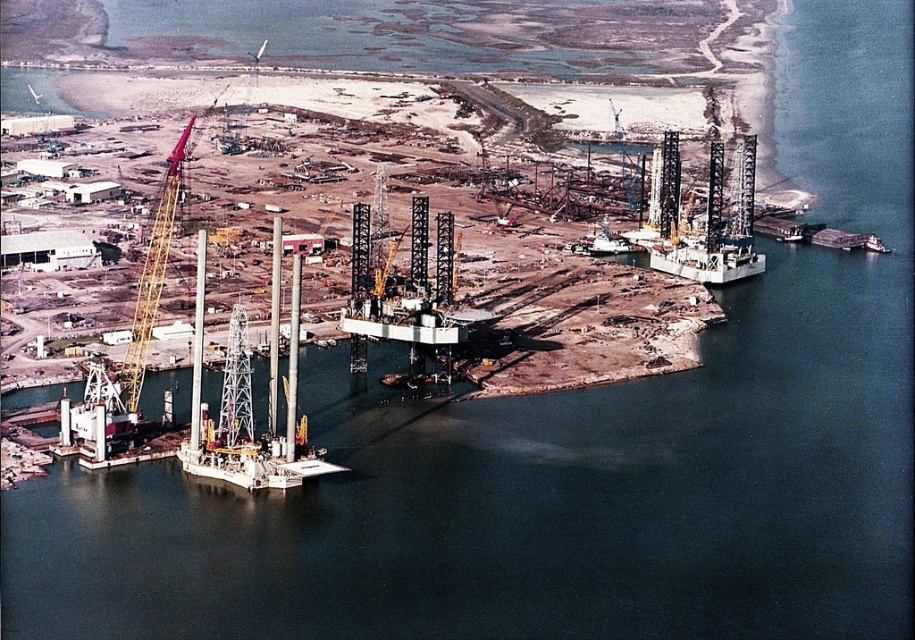
Question: Observing the image, what is the correct spatial positioning of yellow metallic crane at left in reference to metallic gray ship at center?

Choices:
 (A) below
 (B) above

Answer: (A)

Question: Does white matte oil rig at center-right lie behind metallic gray ship at center?

Choices:
 (A) yes
 (B) no

Answer: (A)

Question: Considering the relative positions of white matte oil rig at center-right and metallic gray ship at center in the image provided, where is white matte oil rig at center-right located with respect to metallic gray ship at center?

Choices:
 (A) right
 (B) left

Answer: (A)

Question: Considering the real-world distances, which object is farthest from the yellow metallic crane at left?

Choices:
 (A) metallic gray ship at center
 (B) white matte oil rig at center-right

Answer: (B)

Question: Which object is farther from the camera taking this photo?

Choices:
 (A) white matte oil rig at center-right
 (B) yellow metallic crane at left
 (C) metallic gray ship at center

Answer: (B)

Question: Which of the following is the farthest from the observer?

Choices:
 (A) (750, 237)
 (B) (151, 273)

Answer: (A)